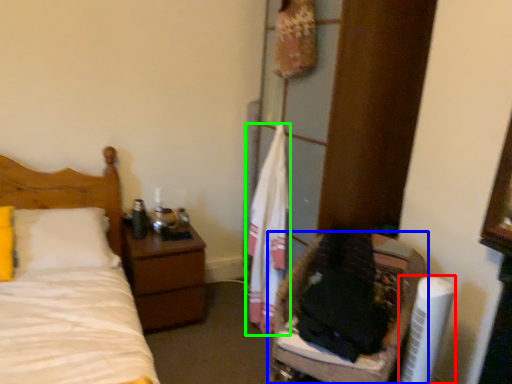
Question: Based on their relative distances, which object is nearer to air conditioner (highlighted by a red box)? Choose from furniture (highlighted by a blue box) and clothe (highlighted by a green box).

Choices:
 (A) furniture
 (B) clothe

Answer: (A)